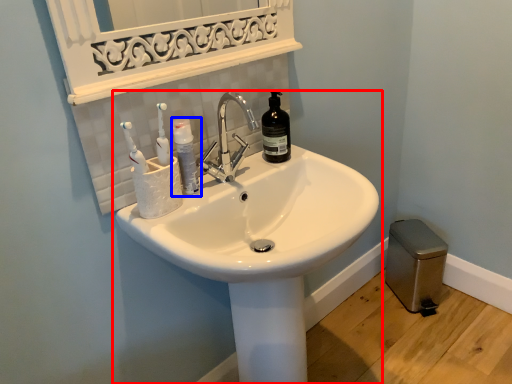
Question: Which object appears farthest to the camera in this image, sink (highlighted by a red box) or mouthwash (highlighted by a blue box)?

Choices:
 (A) sink
 (B) mouthwash

Answer: (B)